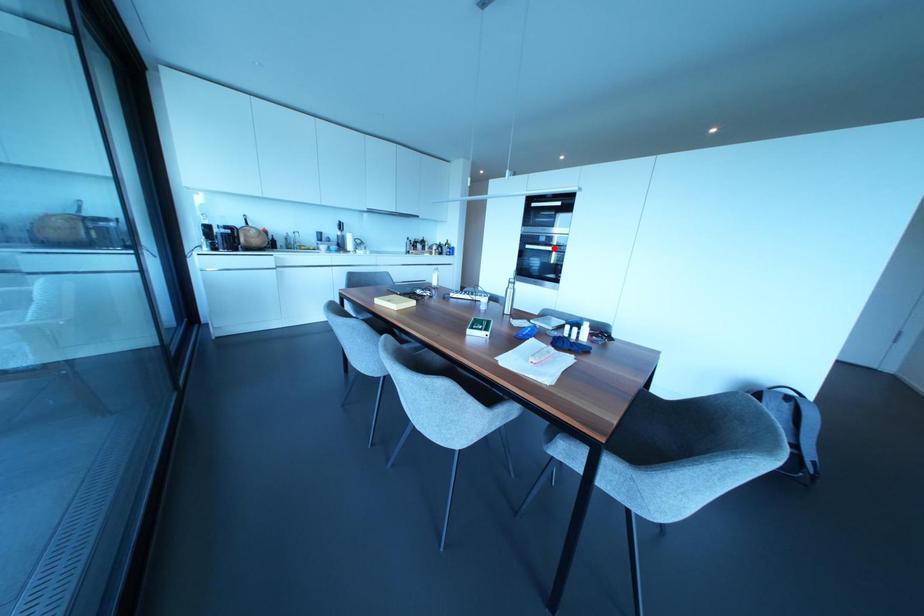
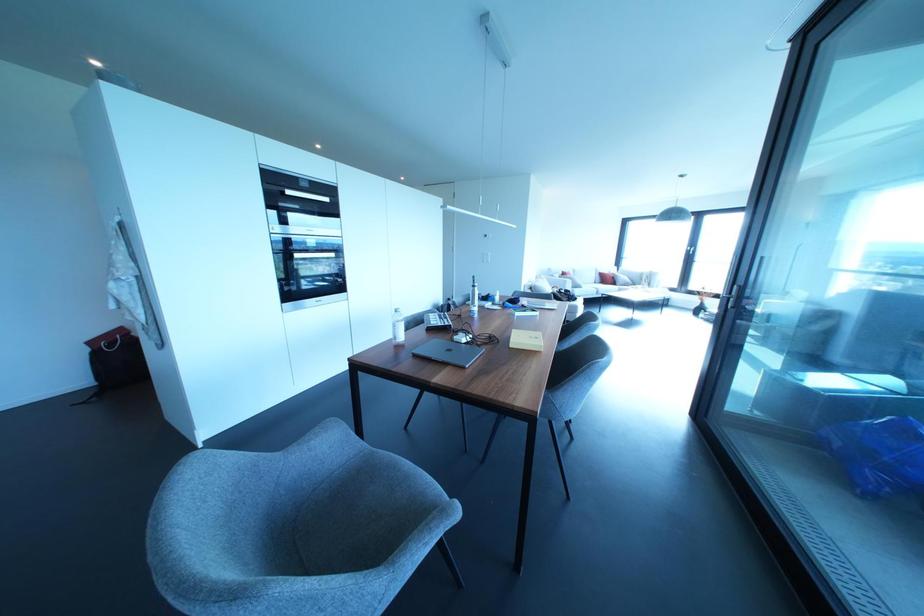
Question: I am providing you with two images of the same scene from different viewpoints. A red point is marked on the first image. At the location where the point appears in image 1, is it still visible in image 2?

Choices:
 (A) Yes
 (B) No

Answer: (A)